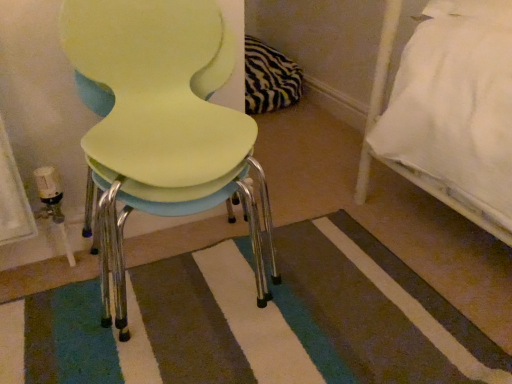
Where is `vacant space underneath matte yellow chair at center (from a real-world perspective)`? vacant space underneath matte yellow chair at center (from a real-world perspective) is located at coordinates (183, 278).